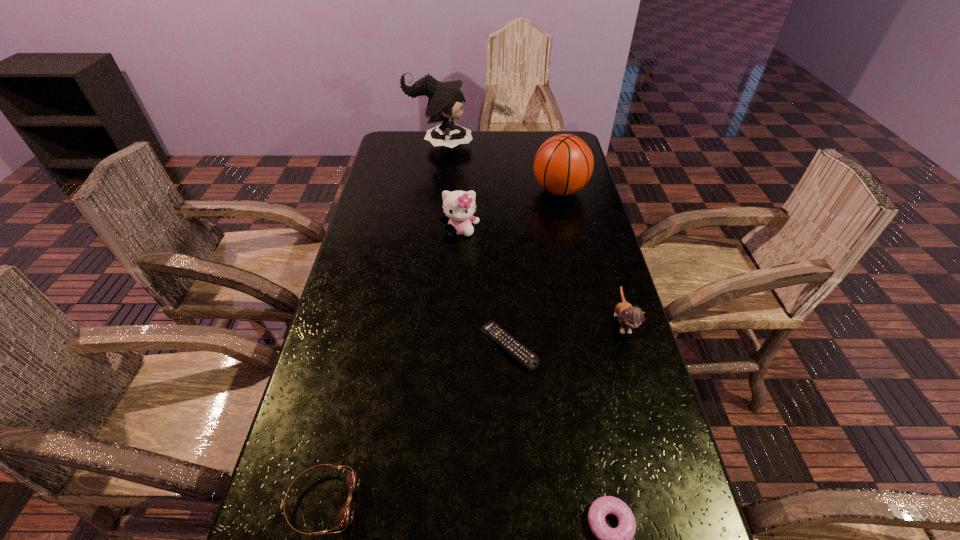
Locate an element on the screen. The image size is (960, 540). doll is located at coordinates (445, 101).

At what (x,y) coordinates should I click in order to perform the action: click on the farthest object. Please return your answer as a coordinate pair (x, y). Looking at the image, I should click on (445, 101).

Locate an element on the screen. basketball is located at coordinates (563, 164).

The image size is (960, 540). What are the coordinates of `the sixth nearest object` in the screenshot? It's located at (563, 164).

Locate an element on the screen. The width and height of the screenshot is (960, 540). the third farthest object is located at coordinates (458, 206).

The image size is (960, 540). I want to click on the left kitten, so click(x=458, y=206).

Image resolution: width=960 pixels, height=540 pixels. I want to click on the right kitten, so click(629, 317).

Identify the location of the shorter kitten. The height and width of the screenshot is (540, 960). (629, 317).

Where is `goggles`? This screenshot has width=960, height=540. goggles is located at coordinates (344, 517).

The height and width of the screenshot is (540, 960). What are the coordinates of `the shortest object` in the screenshot? It's located at (528, 359).